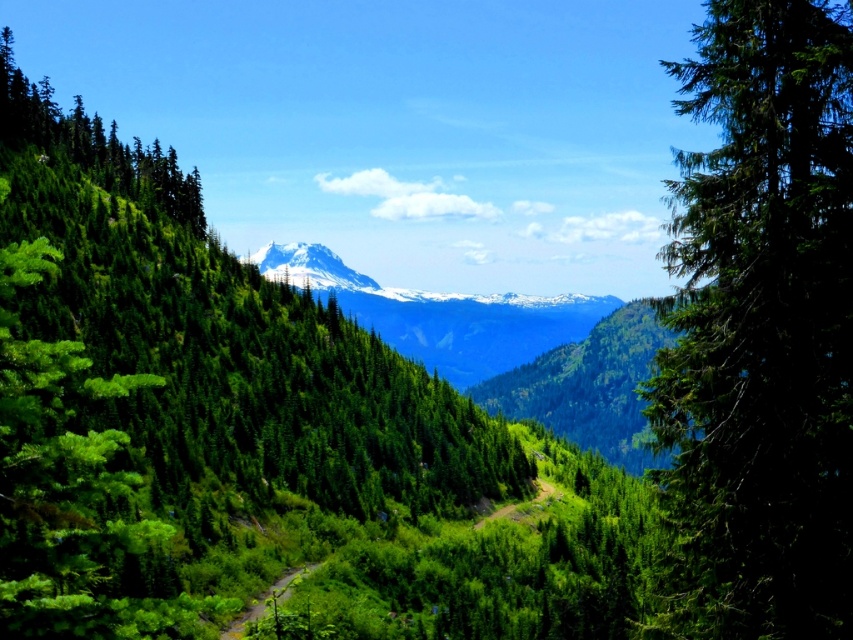
Does green glossy tree at left have a lesser width compared to snowy rocky mountain range at center?

Yes, green glossy tree at left is thinner than snowy rocky mountain range at center.

Does point (28, 460) come farther from viewer compared to point (373, 310)?

That is False.

Is point (56, 404) positioned before point (566, 294)?

Yes, point (56, 404) is closer to viewer.

Where is `green glossy tree at left`? green glossy tree at left is located at coordinates (67, 486).

Is the position of green needle-like at right less distant than that of green glossy tree at left?

No.

Can you confirm if green needle-like at right is positioned above green glossy tree at left?

Yes, green needle-like at right is above green glossy tree at left.

Is point (827, 236) positioned behind point (76, 620)?

Yes.

You are a GUI agent. You are given a task and a screenshot of the screen. Output one action in this format:
    pyautogui.click(x=<x>, y=<y>)
    Task: Click on the green needle-like at right
    The height and width of the screenshot is (640, 853).
    Given the screenshot: What is the action you would take?
    pyautogui.click(x=759, y=330)

Does green needle-like at right have a larger size compared to snowy rocky mountain range at center?

No.

In the scene shown: Which is more to the right, green needle-like at right or snowy rocky mountain range at center?

snowy rocky mountain range at center is more to the right.

Which is in front, point (660, 620) or point (549, 298)?

Point (660, 620)

The width and height of the screenshot is (853, 640). Identify the location of green needle-like at right. (759, 330).